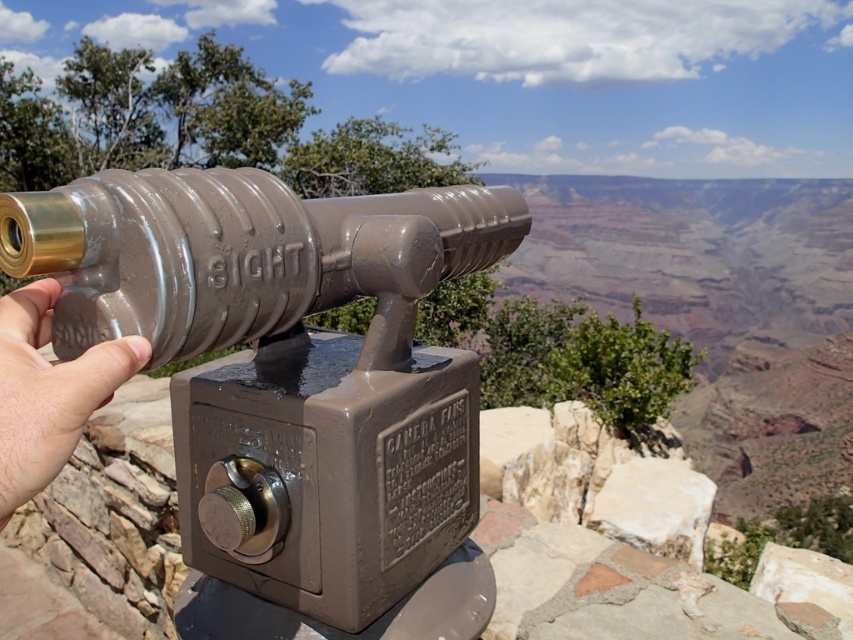
You are adjusting the focus ring on the telescope to view two points in the scene. The points are labeled as point (241,205) and point (39,342). Which point should you focus on first if you want to observe the closest object to the camera?

Point (39,342) is closer to the camera than point (241,205), so you should focus on point (39,342) first to observe the closest object.

You are a visitor at the overlook and want to use the telescope to view the Grand Canyon. However, you notice another person standing at the center. Can you tell if the matte brown telescope at center is big enough for you to use without needing to move the pale skin at center?

The matte brown telescope at center is larger in size compared to pale skin at center, so it should be possible to use the telescope without needing to move the pale skin at center, as there is enough space between them.

You are standing at the scenic overlook and want to locate the matte brown telescope at center. What are the coordinates where you should look to find it?

The matte brown telescope at center is located at coordinates point (285,364).